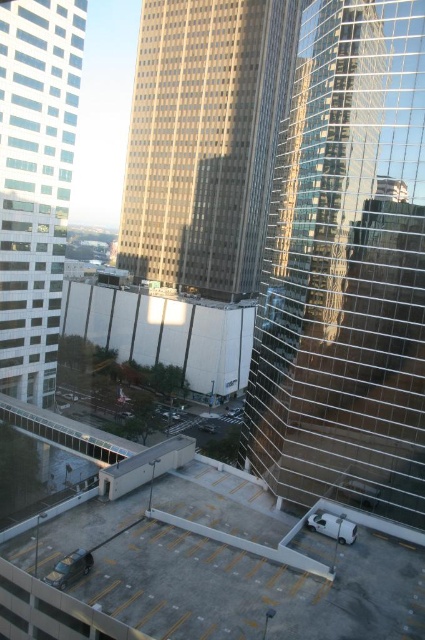
Question: Which of these objects is positioned farthest from the reflective glass tower at right?

Choices:
 (A) white matte parking garage at center
 (B) gold glass skyscraper at center

Answer: (B)

Question: Which of these objects is positioned farthest from the white matte parking garage at center?

Choices:
 (A) gold glass skyscraper at center
 (B) reflective glass tower at right
 (C) white glass building at left

Answer: (B)

Question: Is reflective glass tower at right smaller than gold glass skyscraper at center?

Choices:
 (A) no
 (B) yes

Answer: (B)

Question: Among these objects, which one is farthest from the camera?

Choices:
 (A) gold glass skyscraper at center
 (B) white glass building at left
 (C) reflective glass tower at right
 (D) white matte parking garage at center

Answer: (D)

Question: In this image, where is white glass building at left located relative to white matte parking garage at center?

Choices:
 (A) left
 (B) right

Answer: (A)

Question: Is the position of reflective glass tower at right less distant than that of white glass building at left?

Choices:
 (A) yes
 (B) no

Answer: (A)